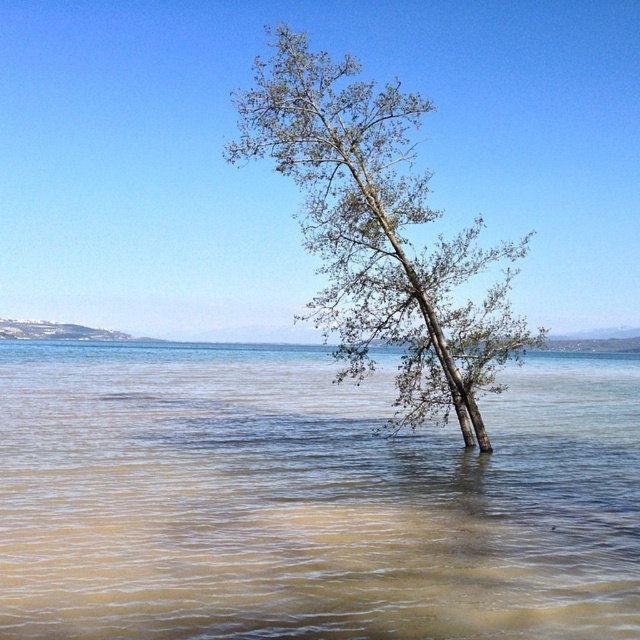
Question: Among these objects, which one is farthest from the camera?

Choices:
 (A) green leafy tree at center
 (B) brown muddy water at center

Answer: (A)

Question: Can you confirm if brown muddy water at center is bigger than green leafy tree at center?

Choices:
 (A) yes
 (B) no

Answer: (B)

Question: Which point is closer to the camera taking this photo?

Choices:
 (A) (346, 248)
 (B) (76, 556)

Answer: (B)

Question: Which of the following is the farthest from the observer?

Choices:
 (A) green leafy tree at center
 (B) brown muddy water at center

Answer: (A)

Question: Can you confirm if brown muddy water at center is positioned to the right of green leafy tree at center?

Choices:
 (A) no
 (B) yes

Answer: (A)

Question: Is brown muddy water at center below green leafy tree at center?

Choices:
 (A) yes
 (B) no

Answer: (A)